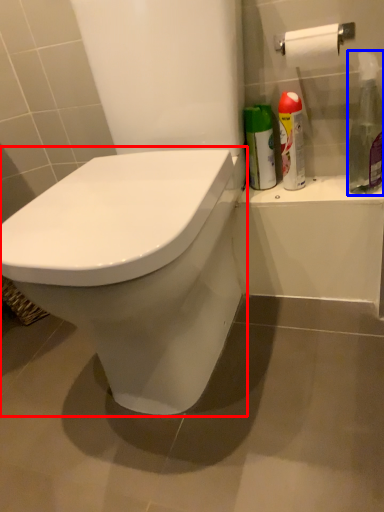
Question: Which object is closer to the camera taking this photo, toilet (highlighted by a red box) or cleaning product (highlighted by a blue box)?

Choices:
 (A) toilet
 (B) cleaning product

Answer: (A)